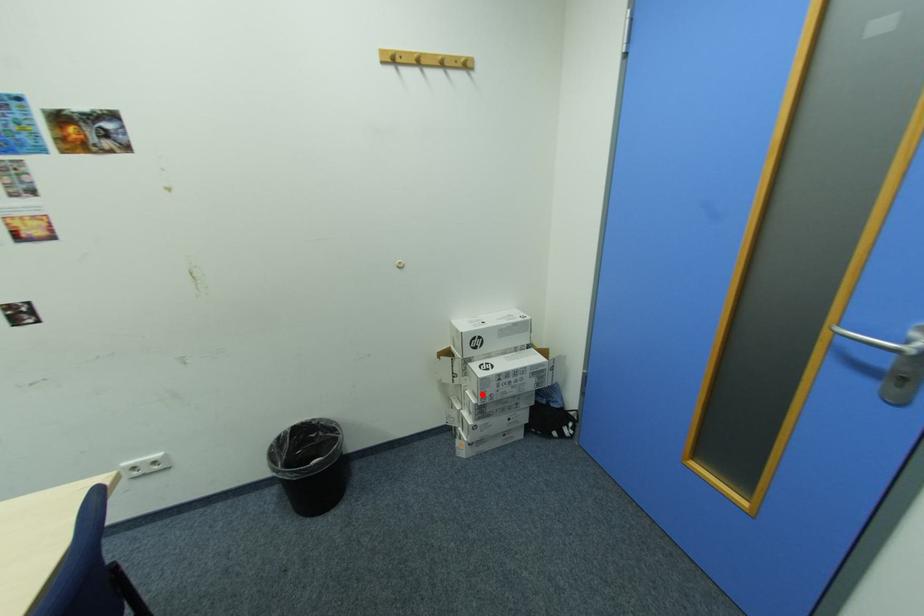
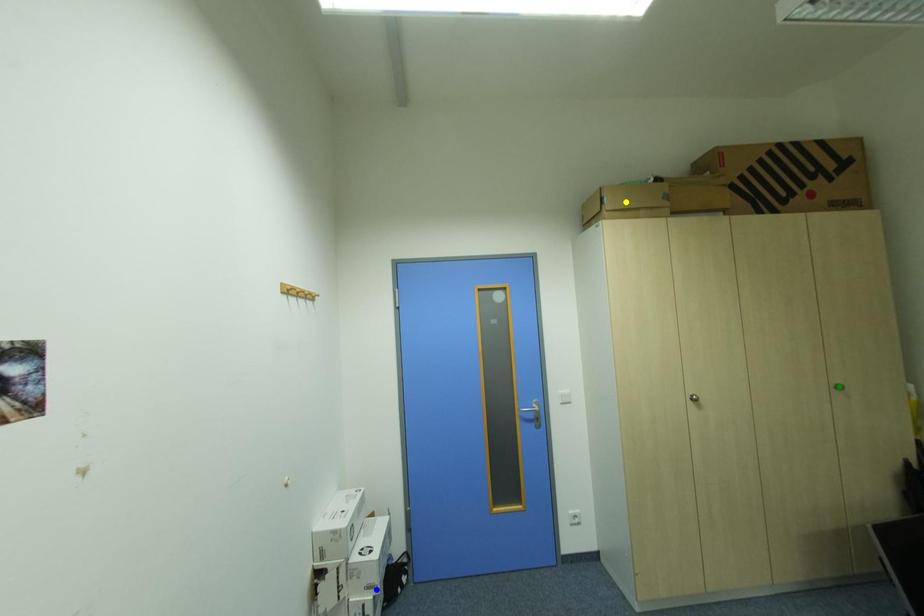
Question: I am providing you with two images of the same scene from different viewpoints. A red point is marked on the first image. You are given multiple points on the second image. Which point in image 2 is actually the same real-world point as the red point in image 1?

Choices:
 (A) yellow point
 (B) blue point
 (C) green point

Answer: (B)